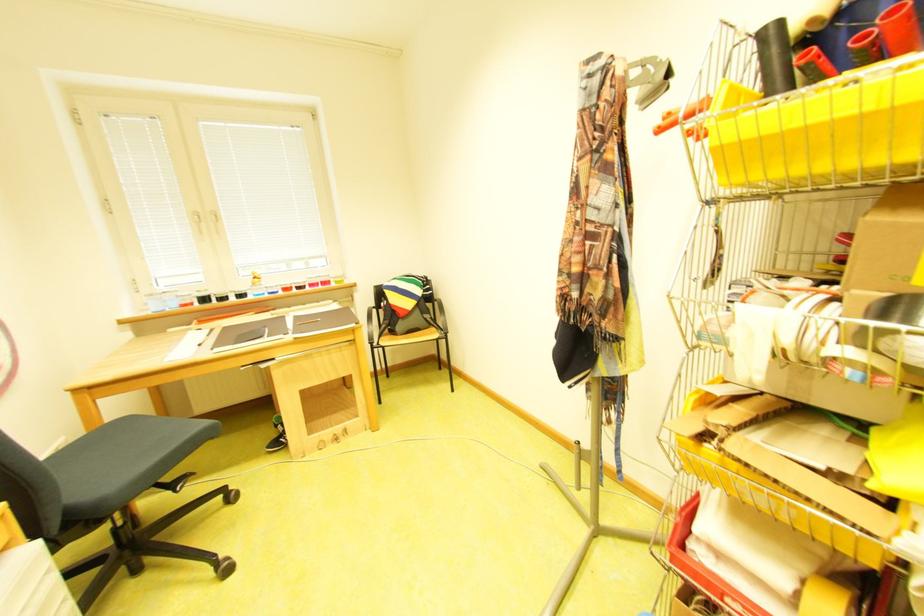
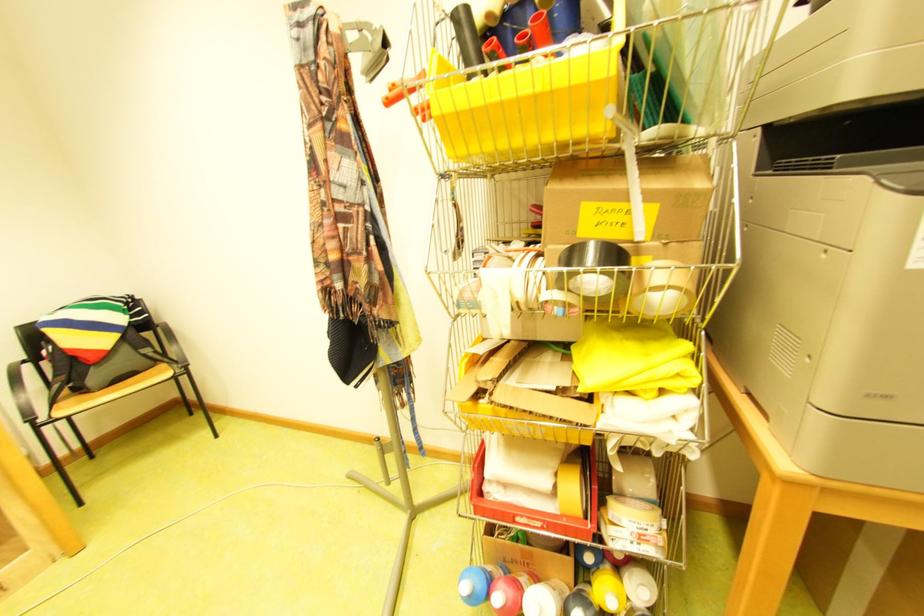
Locate, in the second image, the point that corresponds to [873,50] in the first image.

(531, 51)